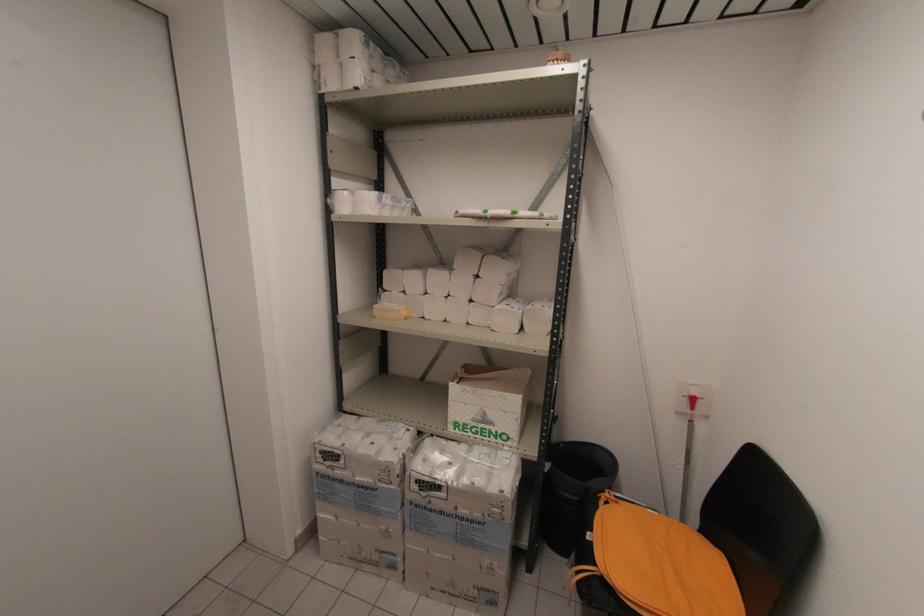
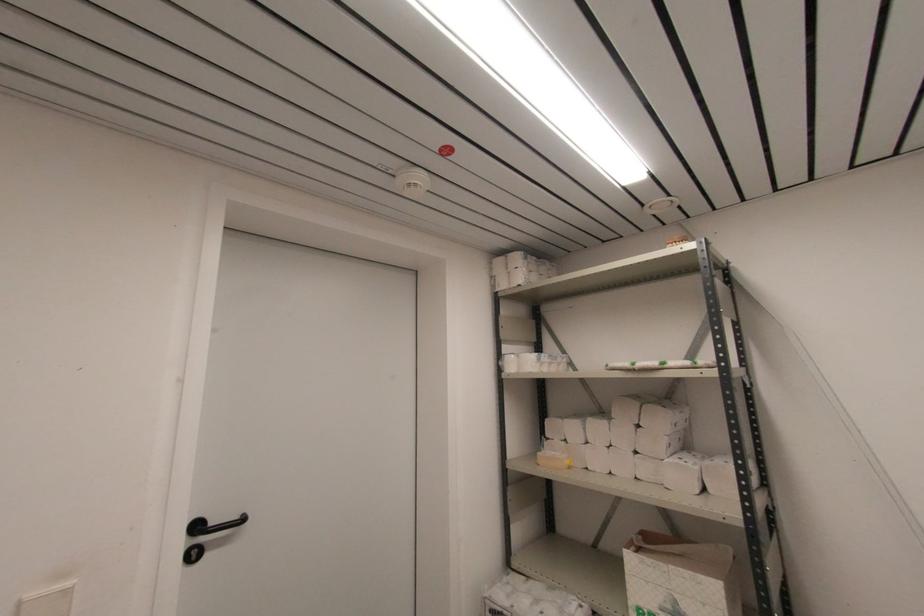
The point at (385, 288) is marked in the first image. Where is the corresponding point in the second image?

(548, 436)